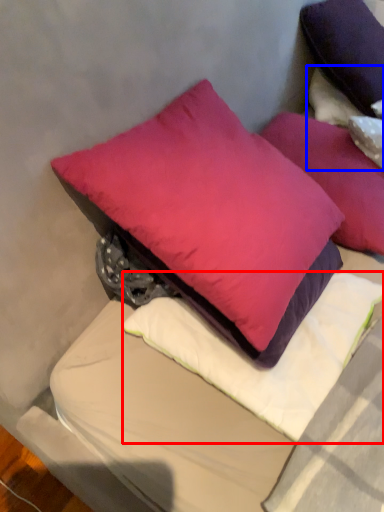
Question: Among these objects, which one is farthest to the camera, pillow (highlighted by a red box) or pillow (highlighted by a blue box)?

Choices:
 (A) pillow
 (B) pillow

Answer: (B)